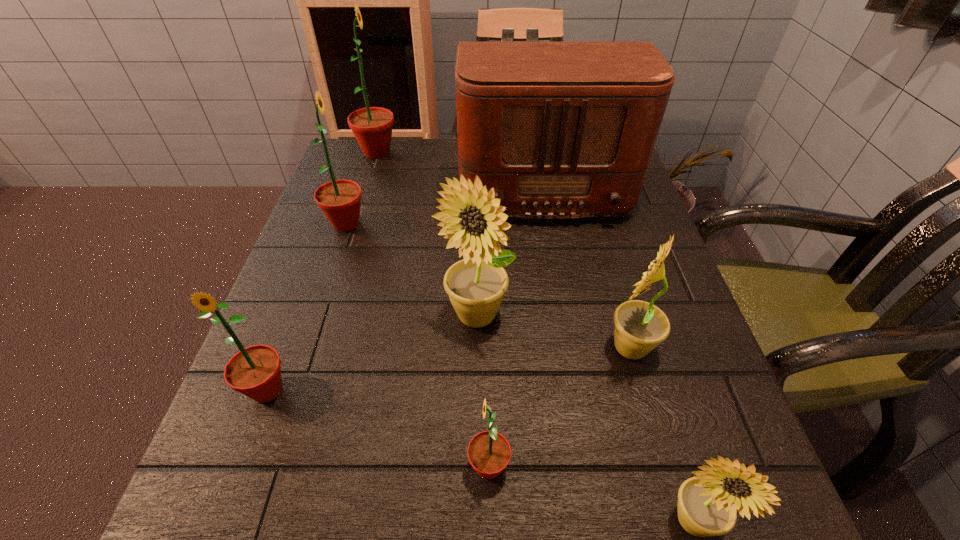
Where is `the biggest green sunflower`? The height and width of the screenshot is (540, 960). the biggest green sunflower is located at coordinates (372, 127).

Where is `the farthest green sunflower`? The height and width of the screenshot is (540, 960). the farthest green sunflower is located at coordinates (372, 127).

Find the location of `brown radio receiver`. brown radio receiver is located at coordinates (560, 130).

The width and height of the screenshot is (960, 540). In order to click on the second biggest green sunflower in this screenshot , I will do `click(340, 200)`.

Find the location of a particular element. This screenshot has width=960, height=540. the sixth nearest sunflower is located at coordinates 340,200.

Locate an element on the screen. This screenshot has width=960, height=540. the leftmost yellow sunflower is located at coordinates (476, 286).

Where is `the second biggest yellow sunflower`? The width and height of the screenshot is (960, 540). the second biggest yellow sunflower is located at coordinates (639, 326).

The image size is (960, 540). I want to click on the second nearest green sunflower, so click(255, 371).

Where is `the sixth farthest sunflower`? Image resolution: width=960 pixels, height=540 pixels. the sixth farthest sunflower is located at coordinates (489, 452).

Locate an element on the screen. The image size is (960, 540). the second nearest object is located at coordinates (489, 452).